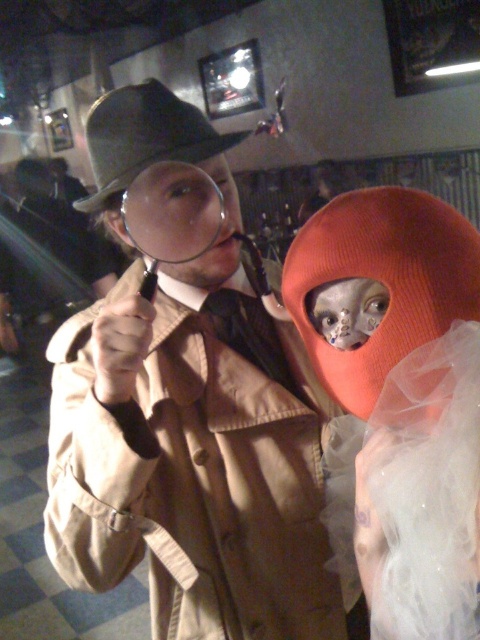
You are a photographer setting up for a group photo. You notice the brown leather trench coat at center and the orange knitted hat at center. Which object should you adjust to ensure both are in focus? Explain your reasoning.

The brown leather trench coat at center is closer to the viewer than the orange knitted hat at center. To ensure both are in focus, adjust the camera focus to account for the distance between them, possibly using a smaller aperture for a deeper depth of field.